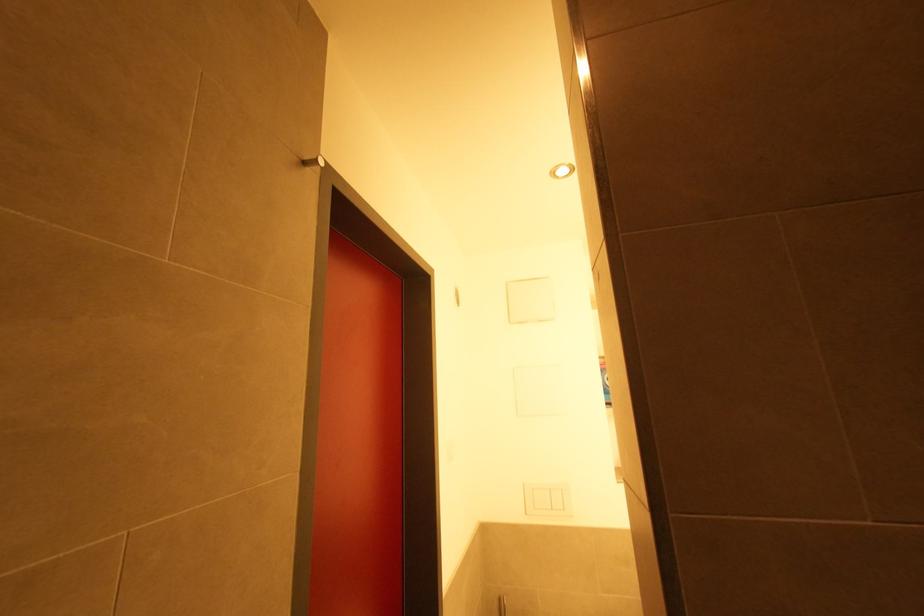
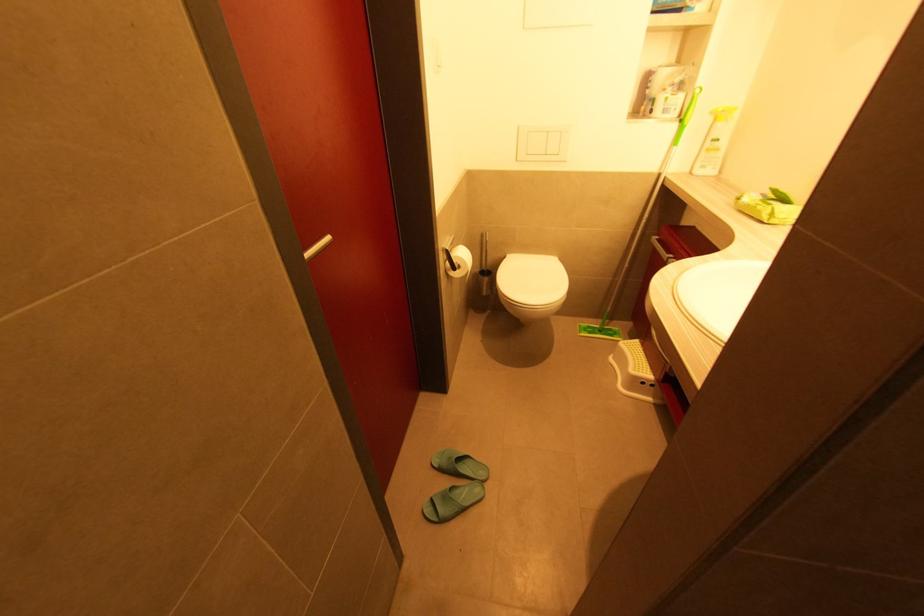
Question: Based on the continuous images, in which direction is the camera rotating? Reply with the corresponding letter.

Choices:
 (A) Left
 (B) Right
 (C) Up
 (D) Down

Answer: (D)